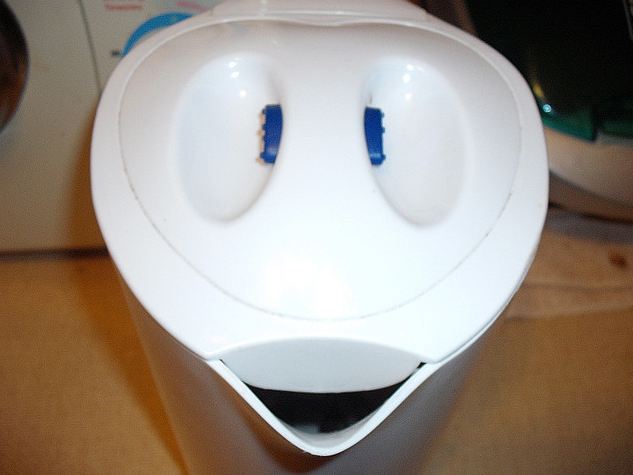
At what (x,y) coordinates should I click in order to perform the action: click on white surface. Please return your answer as a coordinate pair (x, y). The height and width of the screenshot is (475, 633). Looking at the image, I should click on (80, 390).